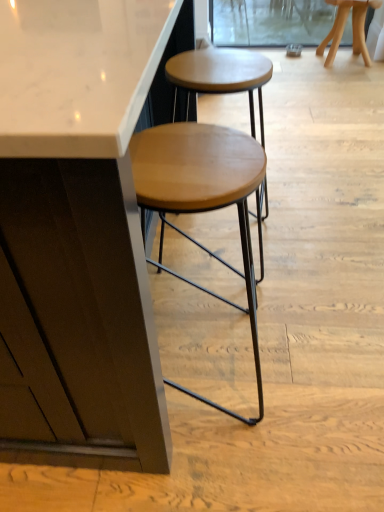
Question: Is wooden stool at upper right, the first stool in the back-to-front sequence, positioned with its back to transparent glass screen door at upper center?

Choices:
 (A) no
 (B) yes

Answer: (A)

Question: From the image's perspective, would you say wooden stool at upper right, which is the second stool from left to right, is shown under transparent glass screen door at upper center?

Choices:
 (A) no
 (B) yes

Answer: (B)

Question: From a real-world perspective, is wooden stool at upper right, positioned as the second stool in bottom-to-top order, positioned over transparent glass screen door at upper center based on gravity?

Choices:
 (A) no
 (B) yes

Answer: (B)

Question: Is wooden stool at upper right, the 1th stool when ordered from right to left, beside transparent glass screen door at upper center?

Choices:
 (A) yes
 (B) no

Answer: (B)

Question: Considering the relative sizes of wooden stool at upper right, positioned as the second stool in bottom-to-top order, and transparent glass screen door at upper center in the image provided, is wooden stool at upper right, positioned as the second stool in bottom-to-top order, smaller than transparent glass screen door at upper center?

Choices:
 (A) yes
 (B) no

Answer: (B)

Question: From a real-world perspective, is wooden stool at upper right, which is counted as the first stool, starting from the top, physically located above or below wooden seat at center, the second stool in the right-to-left sequence?

Choices:
 (A) below
 (B) above

Answer: (A)

Question: Visually, is wooden stool at upper right, the 1th stool when ordered from right to left, positioned to the left or to the right of wooden seat at center, the second stool in the right-to-left sequence?

Choices:
 (A) left
 (B) right

Answer: (B)

Question: Is wooden stool at upper right, which is the second stool from left to right, bigger or smaller than wooden seat at center, the first stool ordered from the bottom?

Choices:
 (A) small
 (B) big

Answer: (A)

Question: In terms of height, does wooden stool at upper right, which is the second stool from left to right, look taller or shorter compared to wooden seat at center, the first stool in the front-to-back sequence?

Choices:
 (A) short
 (B) tall

Answer: (A)

Question: Based on their sizes in the image, would you say wooden seat at center, the second stool in the back-to-front sequence, is bigger or smaller than transparent glass screen door at upper center?

Choices:
 (A) small
 (B) big

Answer: (B)

Question: In terms of height, does wooden seat at center, the second stool in the back-to-front sequence, look taller or shorter compared to transparent glass screen door at upper center?

Choices:
 (A) short
 (B) tall

Answer: (B)

Question: Would you say wooden seat at center, the first stool in the front-to-back sequence, is inside or outside transparent glass screen door at upper center?

Choices:
 (A) outside
 (B) inside

Answer: (A)

Question: Considering the relative positions of wooden seat at center, the 1th stool from the left, and transparent glass screen door at upper center in the image provided, is wooden seat at center, the 1th stool from the left, to the left or to the right of transparent glass screen door at upper center?

Choices:
 (A) right
 (B) left

Answer: (B)

Question: From a real-world perspective, is wooden stool at upper right, positioned as the second stool in bottom-to-top order, above or below transparent glass screen door at upper center?

Choices:
 (A) above
 (B) below

Answer: (A)

Question: Is point (322, 51) positioned closer to the camera than point (211, 20)?

Choices:
 (A) farther
 (B) closer

Answer: (B)